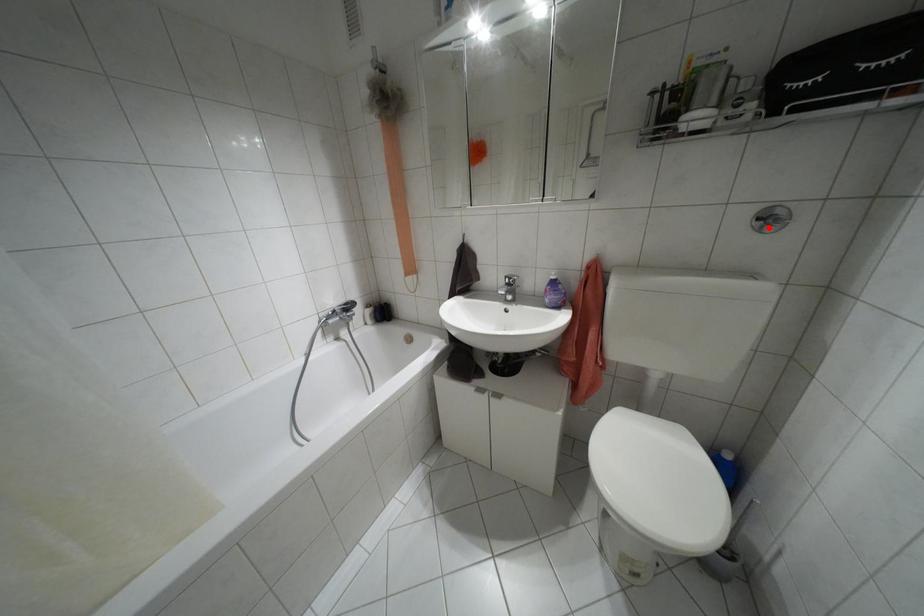
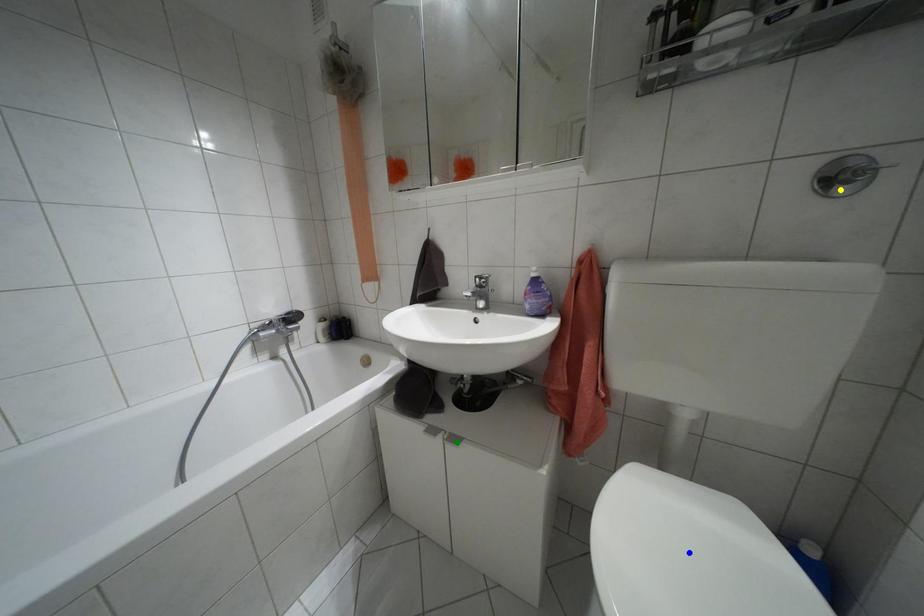
Question: I am providing you with two images of the same scene from different viewpoints. A red point is marked on the first image. You are given multiple points on the second image. Can you choose the point in image 2 that corresponds to the point in image 1?

Choices:
 (A) yellow point
 (B) blue point
 (C) green point

Answer: (A)